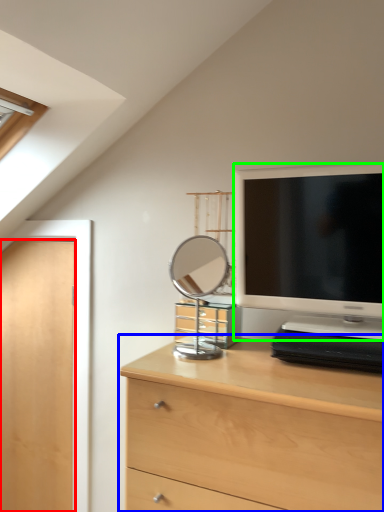
Question: Which object is positioned farthest from door (highlighted by a red box)? Select from chest of drawers (highlighted by a blue box) and television (highlighted by a green box).

Choices:
 (A) chest of drawers
 (B) television

Answer: (B)